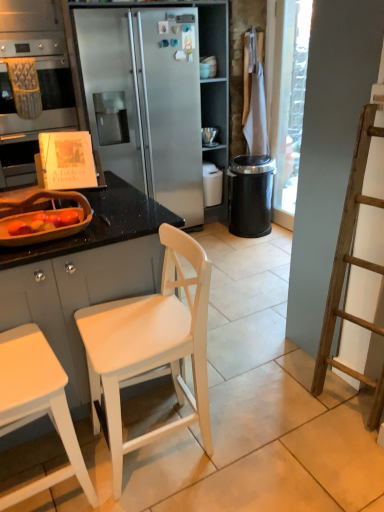
Question: From a real-world perspective, is white matte cabinet at left, which is the 1th cabinetry from bottom to top, above or below white wood chair at center?

Choices:
 (A) below
 (B) above

Answer: (A)

Question: Would you say white matte cabinet at left, which is the 1th cabinetry from bottom to top, is to the left or to the right of white wood chair at center in the picture?

Choices:
 (A) right
 (B) left

Answer: (B)

Question: Which is nearer to the white matte desk at lower left?

Choices:
 (A) brushed metal oven at left, the 1th cabinetry when ordered from back to front
 (B) wooden bowl at left
 (C) white wood chair at center
 (D) white matte cabinet at left, positioned as the second cabinetry in back-to-front order
 (E) black plastic trash can at center-right

Answer: (C)

Question: Which object is positioned closest to the white matte desk at lower left?

Choices:
 (A) brushed metal oven at left, which is the 2th cabinetry in front-to-back order
 (B) white matte cabinet at left, positioned as the second cabinetry in back-to-front order
 (C) white wood chair at center
 (D) black plastic trash can at center-right
 (E) wooden bowl at left

Answer: (C)